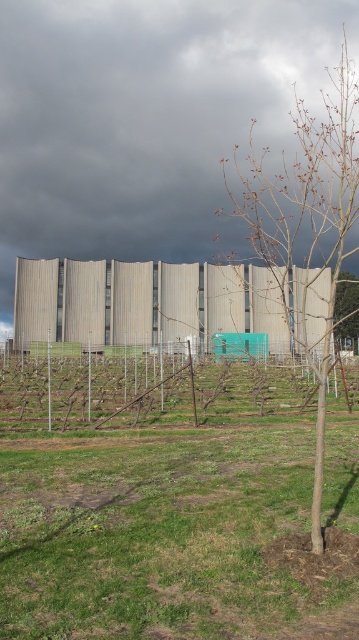
Looking at this image, can you confirm if green grass at center is shorter than bare branches at right?

Yes, green grass at center is shorter than bare branches at right.

Who is lower down, green grass at center or bare branches at right?

green grass at center is below.

You are a GUI agent. You are given a task and a screenshot of the screen. Output one action in this format:
    pyautogui.click(x=<x>, y=<y>)
    Task: Click on the green grass at center
    
    Given the screenshot: What is the action you would take?
    pyautogui.click(x=174, y=509)

Does beige corrugated metal building at center appear on the right side of bare branches at right?

In fact, beige corrugated metal building at center is to the left of bare branches at right.

Is point (229, 316) farther from camera compared to point (341, 316)?

Yes.

Is point (198, 316) positioned behind point (343, 305)?

Yes.

This screenshot has height=640, width=359. In order to click on beige corrugated metal building at center in this screenshot , I will do `click(143, 301)`.

Is green grass at center taller than bare wood tree at right?

Incorrect, green grass at center's height is not larger of bare wood tree at right's.

Which is in front, point (288, 387) or point (254, 241)?

Point (254, 241) is in front.

Locate an element on the screen. The image size is (359, 640). green grass at center is located at coordinates (174, 509).